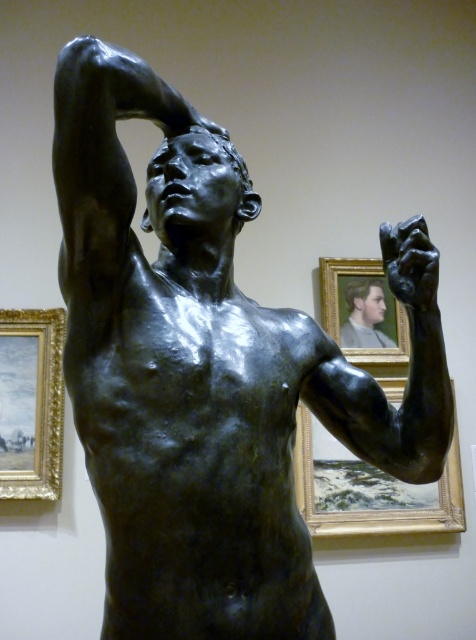
Can you confirm if wooden picture frame at upper right is positioned to the right of gold/gilded picture frame at left?

Correct, you'll find wooden picture frame at upper right to the right of gold/gilded picture frame at left.

Is wooden picture frame at upper right below gold/gilded picture frame at left?

Yes, wooden picture frame at upper right is below gold/gilded picture frame at left.

Is point (353, 513) less distant than point (22, 474)?

No.

Image resolution: width=476 pixels, height=640 pixels. Find the location of `wooden picture frame at upper right`. wooden picture frame at upper right is located at coordinates (368, 490).

Which is below, wooden picture frame at upper right or smooth gray face at upper right?

wooden picture frame at upper right is lower down.

Can you confirm if wooden picture frame at upper right is bigger than smooth gray face at upper right?

Indeed, wooden picture frame at upper right has a larger size compared to smooth gray face at upper right.

Locate an element on the screen. The image size is (476, 640). wooden picture frame at upper right is located at coordinates (368, 490).

In the scene shown: Does wooden picture frame at upper right appear on the right side of matte gold picture frame at upper center?

Correct, you'll find wooden picture frame at upper right to the right of matte gold picture frame at upper center.

Who is more distant from viewer, (347, 497) or (386, 296)?

The point (386, 296) is more distant.

Identify the location of wooden picture frame at upper right. This screenshot has height=640, width=476. (368, 490).